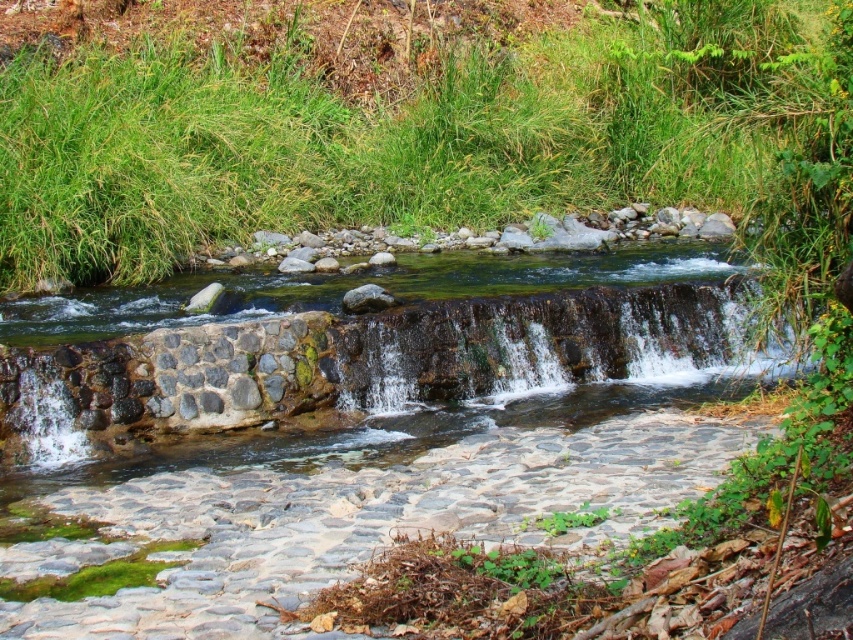
Question: Does green grass at upper center come behind dark brown stone waterfall at center?

Choices:
 (A) yes
 (B) no

Answer: (B)

Question: Which point appears closest to the camera in this image?

Choices:
 (A) (137, 74)
 (B) (503, 356)

Answer: (B)

Question: Is green grass at upper center positioned behind dark brown stone waterfall at center?

Choices:
 (A) yes
 (B) no

Answer: (B)

Question: Can you confirm if green grass at upper center is positioned below dark brown stone waterfall at center?

Choices:
 (A) yes
 (B) no

Answer: (B)

Question: Which object is closer to the camera taking this photo?

Choices:
 (A) green grass at upper center
 (B) dark brown stone waterfall at center

Answer: (A)